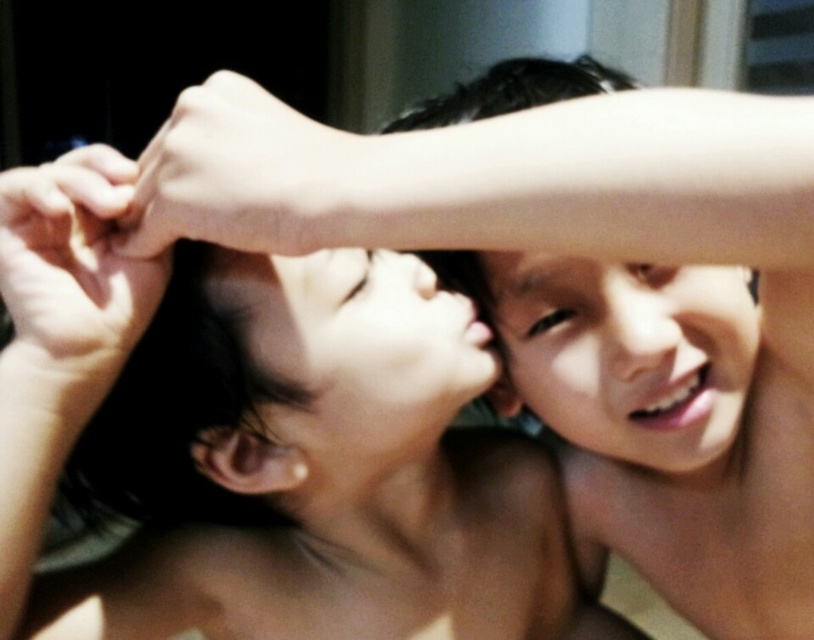
Question: Can you confirm if smooth skin face at upper center is bigger than smooth skin face at center?

Choices:
 (A) no
 (B) yes

Answer: (B)

Question: Which point is farther to the camera?

Choices:
 (A) smooth skin face at upper center
 (B) smooth skin face at center

Answer: (A)

Question: Does smooth skin face at upper center have a lesser width compared to smooth skin face at center?

Choices:
 (A) no
 (B) yes

Answer: (B)

Question: Does smooth skin face at upper center have a lesser width compared to smooth skin face at center?

Choices:
 (A) no
 (B) yes

Answer: (B)